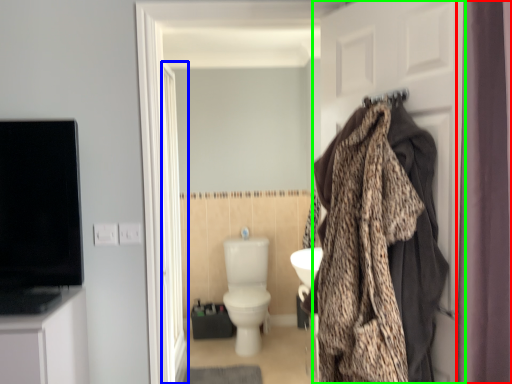
Question: Estimate the real-world distances between objects in this image. Which object is closer to curtain (highlighted by a red box), screen door (highlighted by a blue box) or door (highlighted by a green box)?

Choices:
 (A) screen door
 (B) door

Answer: (B)